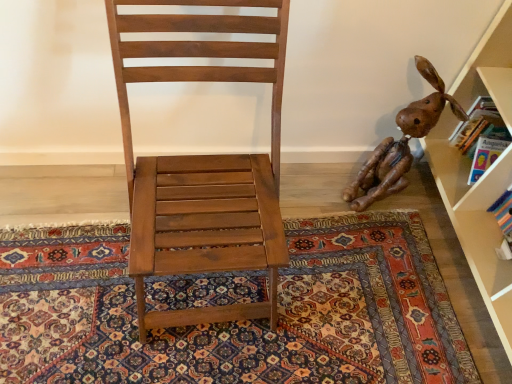
This screenshot has width=512, height=384. I want to click on free space to the left of brown leather dog at right, so click(312, 190).